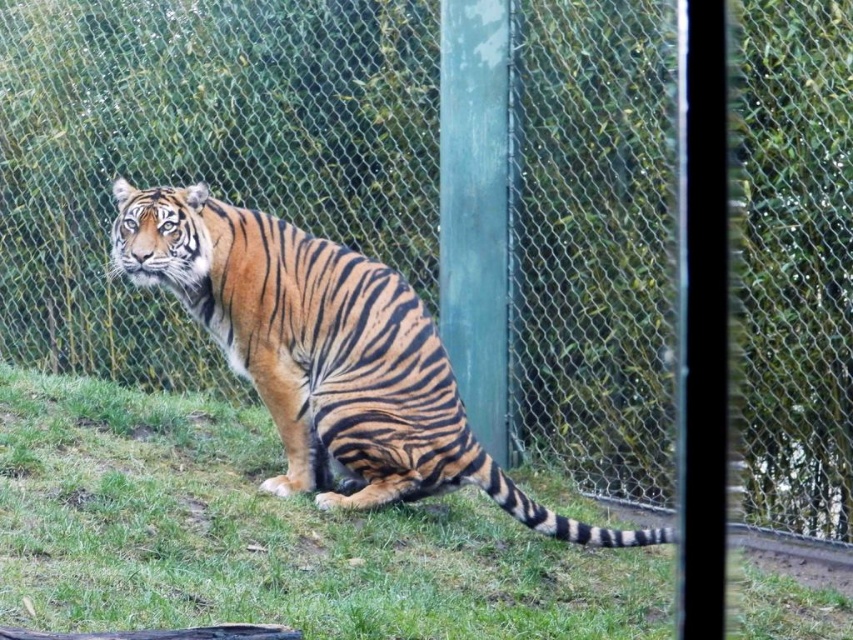
Who is higher up, green grass at lower center or orange-brown striped tiger at center?

orange-brown striped tiger at center is above.

From the picture: Is green grass at lower center shorter than orange-brown striped tiger at center?

Correct, green grass at lower center is not as tall as orange-brown striped tiger at center.

This screenshot has width=853, height=640. I want to click on green grass at lower center, so click(x=268, y=536).